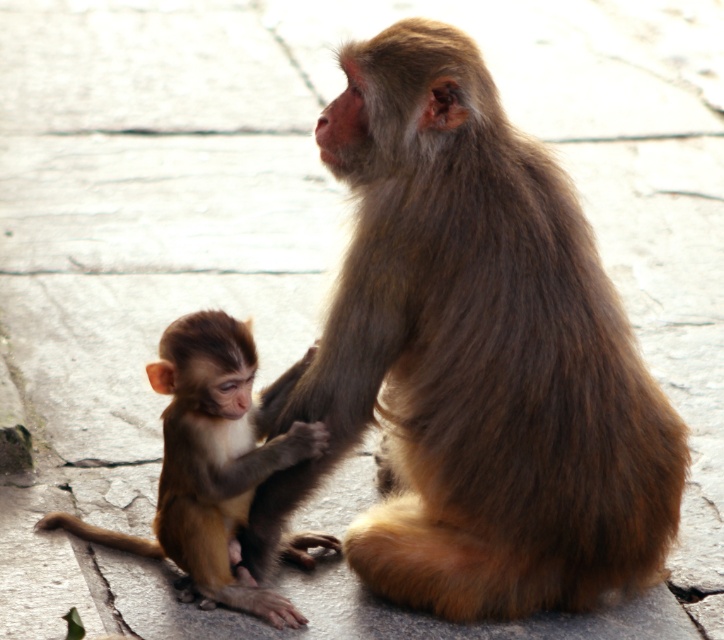
Question: Among these points, which one is farthest from the camera?

Choices:
 (A) (505, 300)
 (B) (218, 579)

Answer: (B)

Question: Is brown furry monkey at center further to camera compared to brown furry monkey at lower left?

Choices:
 (A) no
 (B) yes

Answer: (B)

Question: Is brown furry monkey at center positioned behind brown furry monkey at lower left?

Choices:
 (A) no
 (B) yes

Answer: (B)

Question: Is brown furry monkey at center to the left of brown furry monkey at lower left from the viewer's perspective?

Choices:
 (A) no
 (B) yes

Answer: (A)

Question: Among these points, which one is farthest from the camera?

Choices:
 (A) (185, 426)
 (B) (264, 500)

Answer: (B)